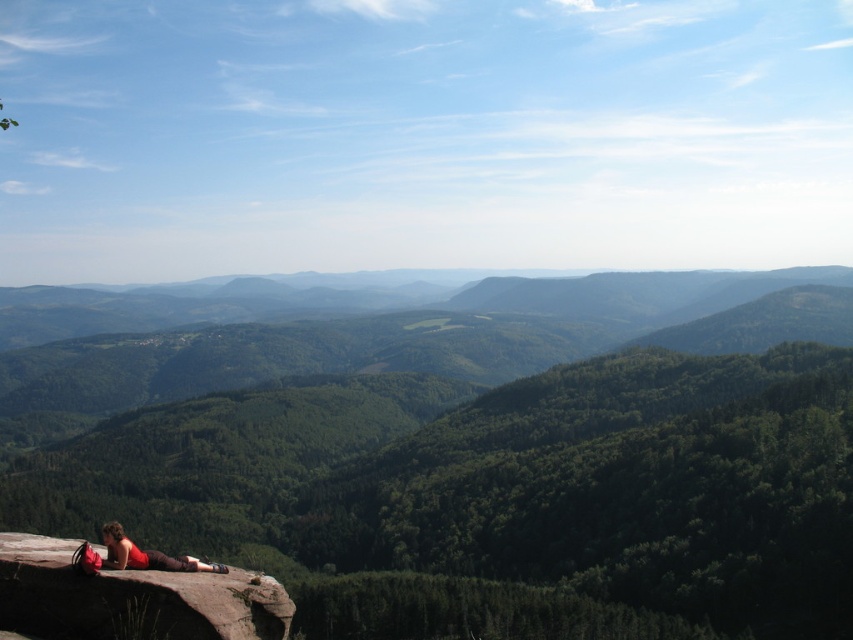
Measure the distance between brown rough cliff at lower left and camera.

brown rough cliff at lower left is 112.74 feet from camera.

Can you confirm if brown rough cliff at lower left is positioned to the left of matte red shirt at lower left?

Indeed, brown rough cliff at lower left is positioned on the left side of matte red shirt at lower left.

Is point (213, 579) in front of point (184, 566)?

Yes, point (213, 579) is closer to viewer.

This screenshot has width=853, height=640. I want to click on brown rough cliff at lower left, so click(x=131, y=598).